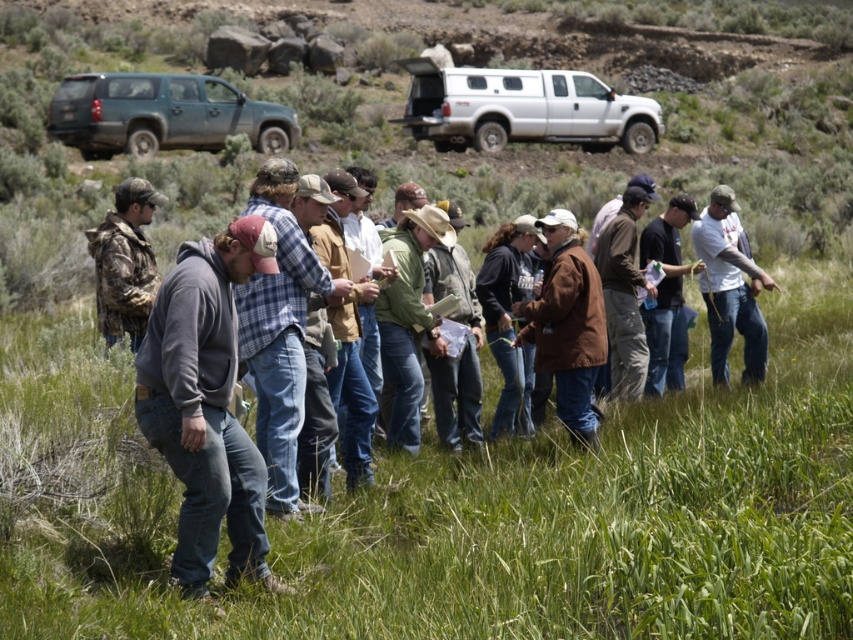
You are a photographer trying to capture both the blue plaid shirt at center and the white matte truck at upper center in a single frame. Given their sizes, which object should you focus on first to ensure both are visible in the photo?

The blue plaid shirt at center has a smaller size compared to the white matte truck at upper center, so you should focus on the blue plaid shirt at center first to ensure both are visible in the photo.

You are standing in the grassy area and want to move from point A to point B. Point A is at coordinate point (231, 109) and point B is at coordinate point (728, 257). Which point is closer to you?

Point A at coordinate point (231, 109) is closer to you because it is further to the viewer than point B at coordinate point (728, 257).